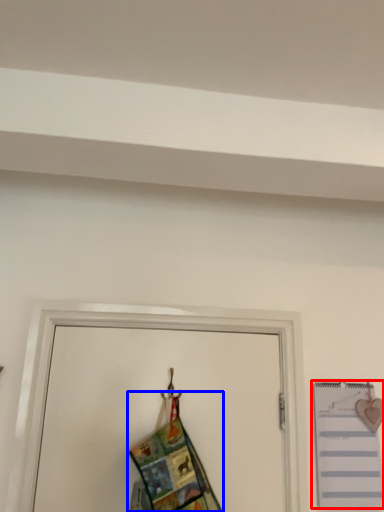
Question: Which point is further to the camera, notebook (highlighted by a red box) or fancy dress (highlighted by a blue box)?

Choices:
 (A) notebook
 (B) fancy dress

Answer: (A)